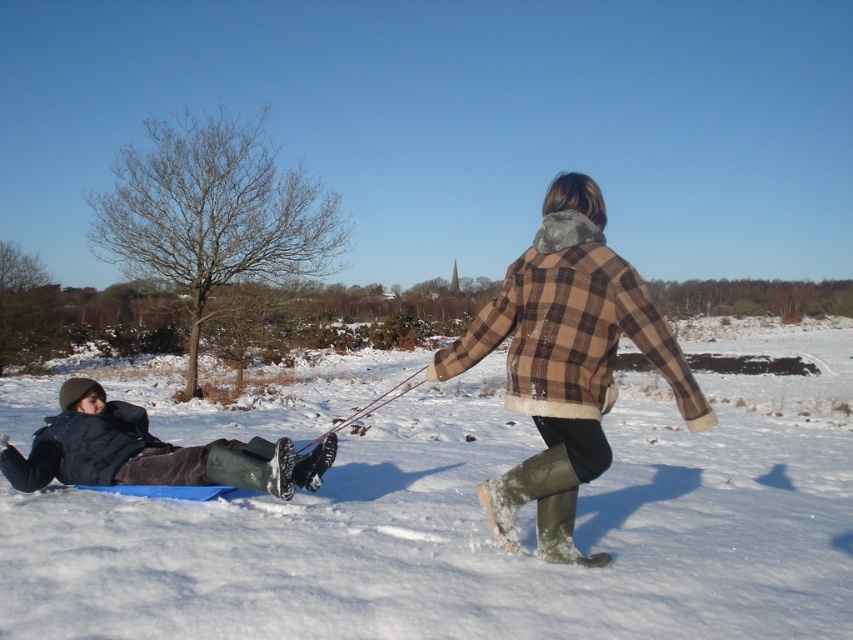
Does white fluffy snow at center appear on the left side of plaid woolen coat at center?

Correct, you'll find white fluffy snow at center to the left of plaid woolen coat at center.

Which of these two, white fluffy snow at center or plaid woolen coat at center, stands taller?

Standing taller between the two is white fluffy snow at center.

Locate an element on the screen. The height and width of the screenshot is (640, 853). white fluffy snow at center is located at coordinates (485, 524).

Is white fluffy snow at center closer to the viewer compared to dark blue fabric at lower left?

Yes, white fluffy snow at center is in front of dark blue fabric at lower left.

Does white fluffy snow at center have a lesser height compared to dark blue fabric at lower left?

Incorrect, white fluffy snow at center's height does not fall short of dark blue fabric at lower left's.

Does point (544, 627) come behind point (57, 468)?

That is False.

Where is `white fluffy snow at center`? This screenshot has height=640, width=853. white fluffy snow at center is located at coordinates (485, 524).

Between plaid woolen coat at center and dark blue fabric at lower left, which one appears on the right side from the viewer's perspective?

From the viewer's perspective, plaid woolen coat at center appears more on the right side.

Is plaid woolen coat at center taller than dark blue fabric at lower left?

Correct, plaid woolen coat at center is much taller as dark blue fabric at lower left.

The image size is (853, 640). Find the location of `plaid woolen coat at center`. plaid woolen coat at center is located at coordinates (566, 362).